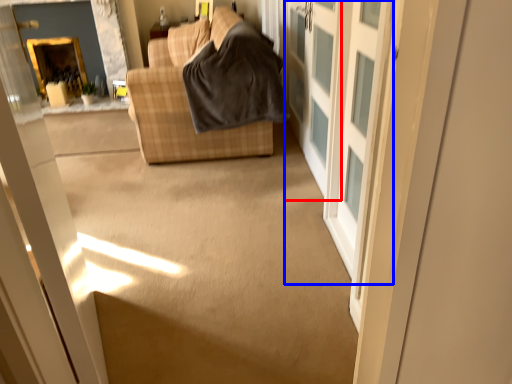
Question: Which object appears farthest to the camera in this image, screen door (highlighted by a red box) or barn door (highlighted by a blue box)?

Choices:
 (A) screen door
 (B) barn door

Answer: (A)